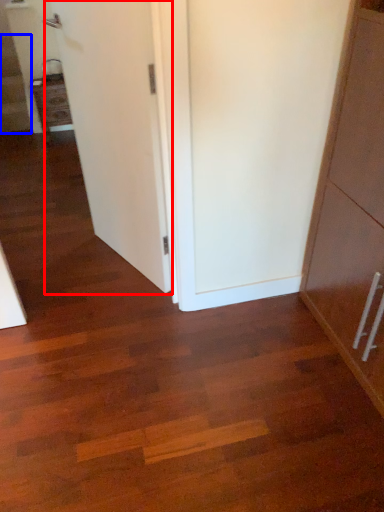
Question: Among these objects, which one is farthest to the camera, door (highlighted by a red box) or stairwell (highlighted by a blue box)?

Choices:
 (A) door
 (B) stairwell

Answer: (B)